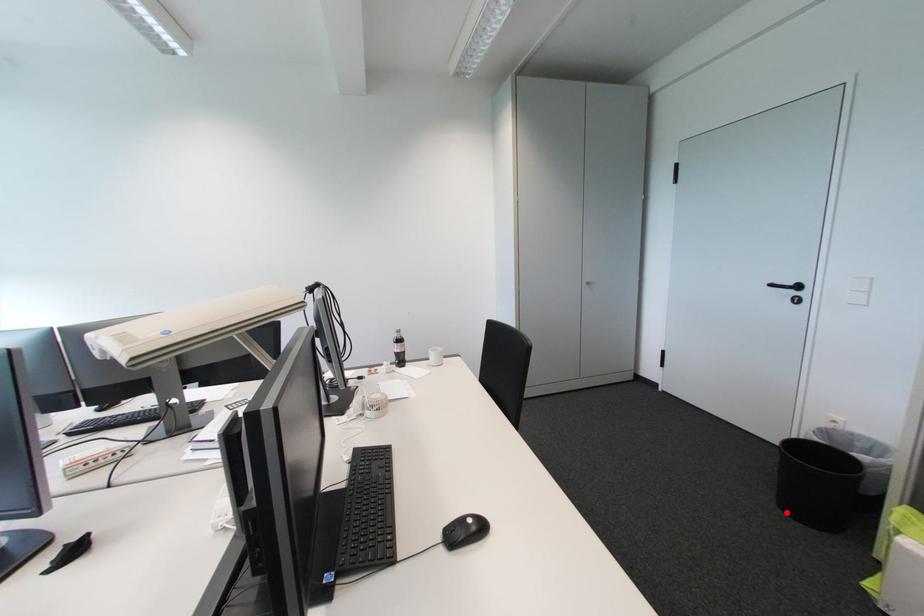
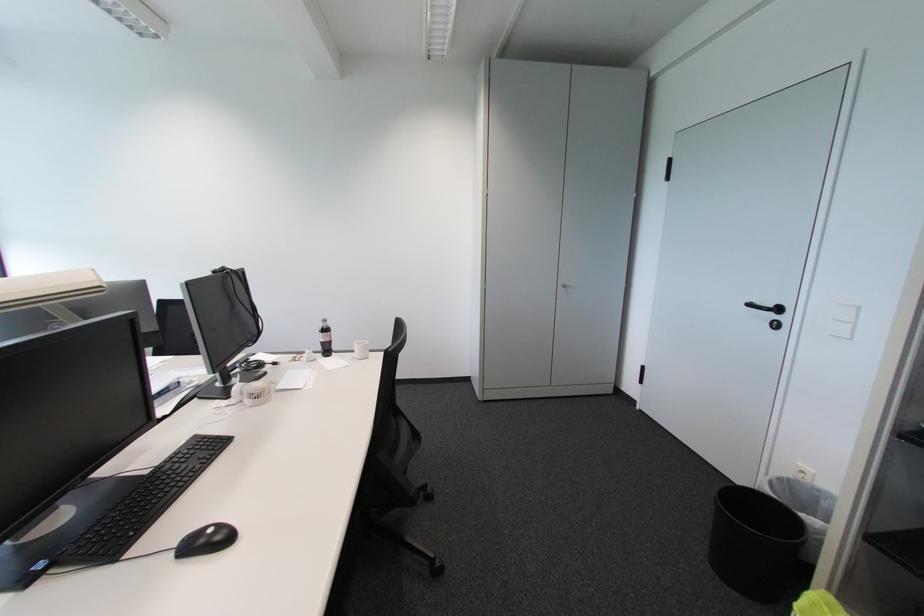
Locate, in the second image, the point that corresponds to the highlighted location in the first image.

(714, 565)